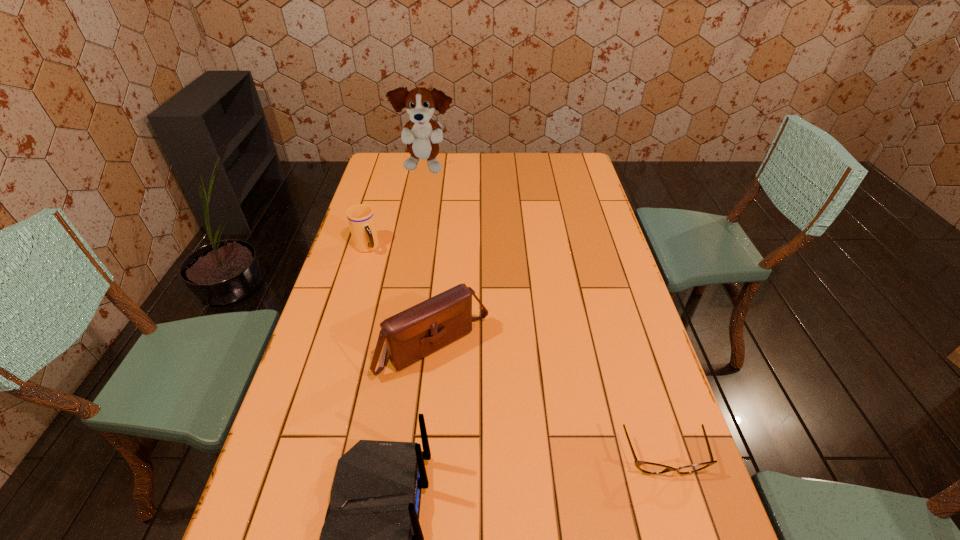
Image resolution: width=960 pixels, height=540 pixels. In order to click on puppy that is at the left edge in this screenshot , I will do `click(421, 134)`.

Locate an element on the screen. The width and height of the screenshot is (960, 540). object at the right edge is located at coordinates (647, 467).

I want to click on object at the far left corner, so click(x=421, y=134).

Where is `vacant area at the far edge of the desktop`? vacant area at the far edge of the desktop is located at coordinates (468, 158).

At what (x,y) coordinates should I click in order to perform the action: click on vacant space at the near edge. Please return your answer as a coordinate pair (x, y). The height and width of the screenshot is (540, 960). Looking at the image, I should click on (545, 513).

Locate an element on the screen. vacant area at the left edge of the desktop is located at coordinates (322, 461).

This screenshot has width=960, height=540. What are the coordinates of `free space at the right edge of the desktop` in the screenshot? It's located at (644, 450).

Where is `vacant space at the near right corner`? Image resolution: width=960 pixels, height=540 pixels. vacant space at the near right corner is located at coordinates (683, 534).

Locate an element on the screen. The image size is (960, 540). vacant point located between the third farthest object and the spectacles is located at coordinates pos(549,402).

The width and height of the screenshot is (960, 540). Identify the location of free spot between the farthest object and the spectacles. (544, 313).